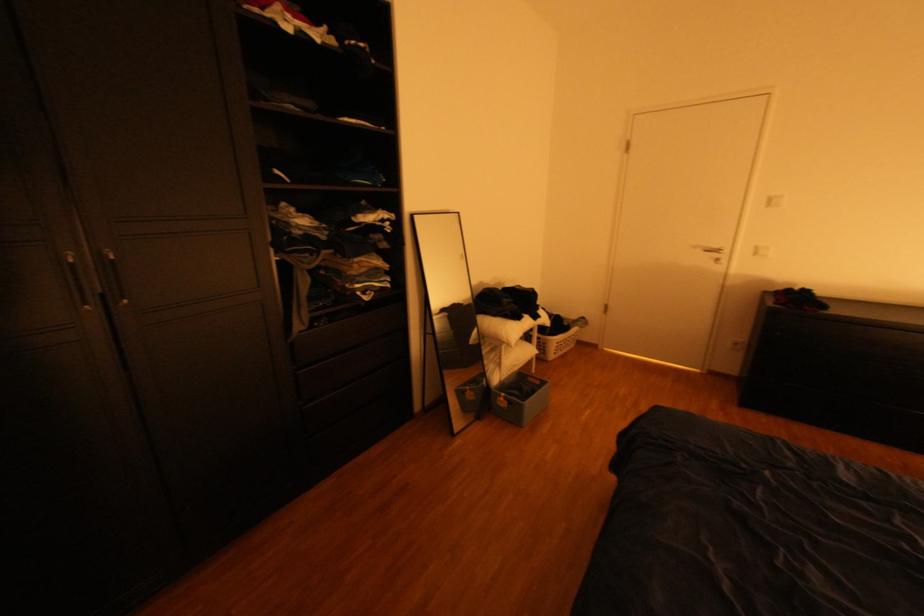
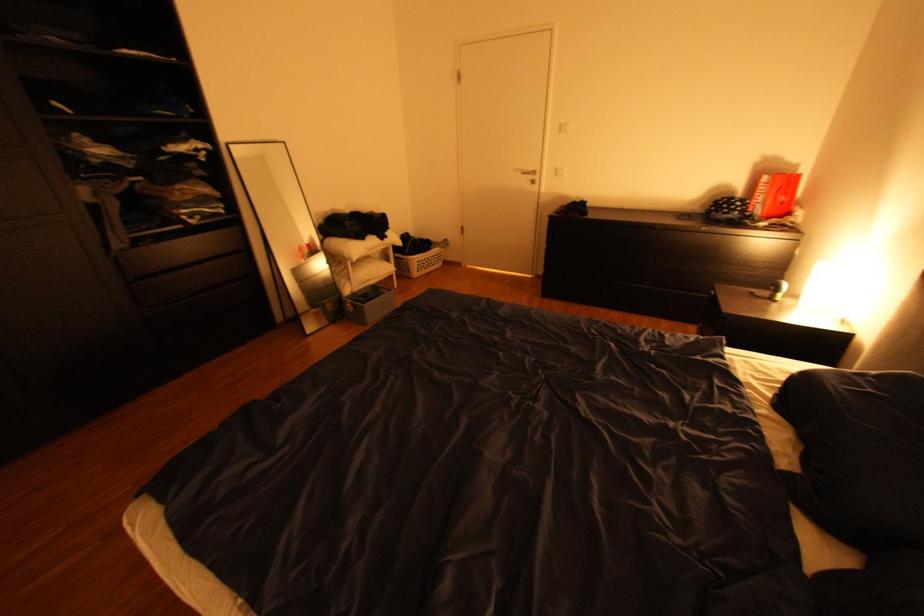
Which direction would the cameraman need to move to produce the second image?

The cameraman walked toward right, backward.